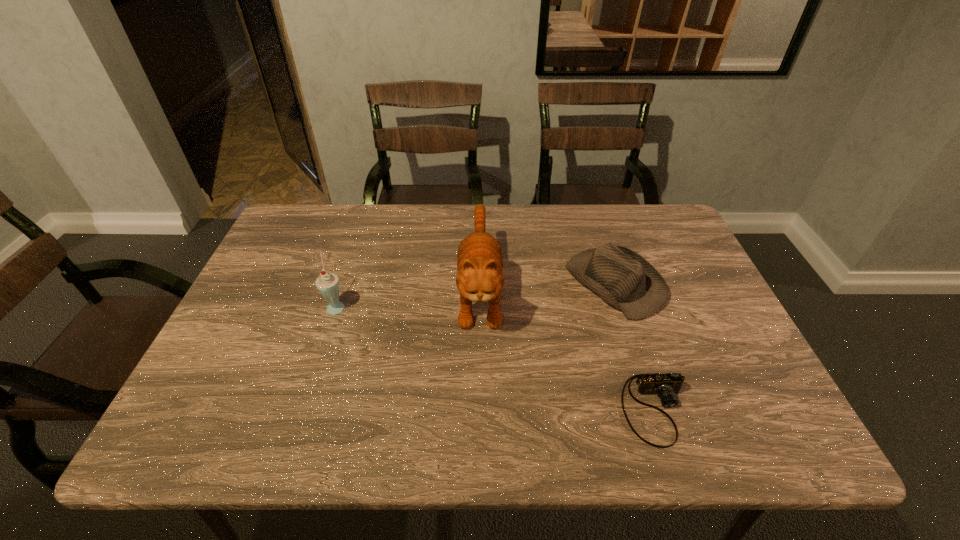
Image resolution: width=960 pixels, height=540 pixels. In order to click on cat that is positioned at the far edge in this screenshot , I will do `click(480, 260)`.

Locate an element on the screen. fedora situated at the far edge is located at coordinates (626, 281).

Locate an element on the screen. object located at the near edge is located at coordinates (666, 386).

The width and height of the screenshot is (960, 540). I want to click on object that is at the right edge, so click(626, 281).

You are a GUI agent. You are given a task and a screenshot of the screen. Output one action in this format:
    pyautogui.click(x=<x>, y=<y>)
    Task: Click on the object that is positioned at the far right corner
    This screenshot has height=540, width=960.
    Given the screenshot: What is the action you would take?
    pyautogui.click(x=626, y=281)

The height and width of the screenshot is (540, 960). What are the coordinates of `vacant space at the far edge of the desktop` in the screenshot? It's located at (586, 220).

The width and height of the screenshot is (960, 540). I want to click on vacant space at the near edge of the desktop, so pos(695,435).

In the image, there is a desktop. Where is `vacant space at the left edge`? vacant space at the left edge is located at coordinates (284, 298).

The height and width of the screenshot is (540, 960). I want to click on free region at the right edge, so click(x=717, y=310).

Where is `free spot at the far left corner of the desktop`? The height and width of the screenshot is (540, 960). free spot at the far left corner of the desktop is located at coordinates (330, 209).